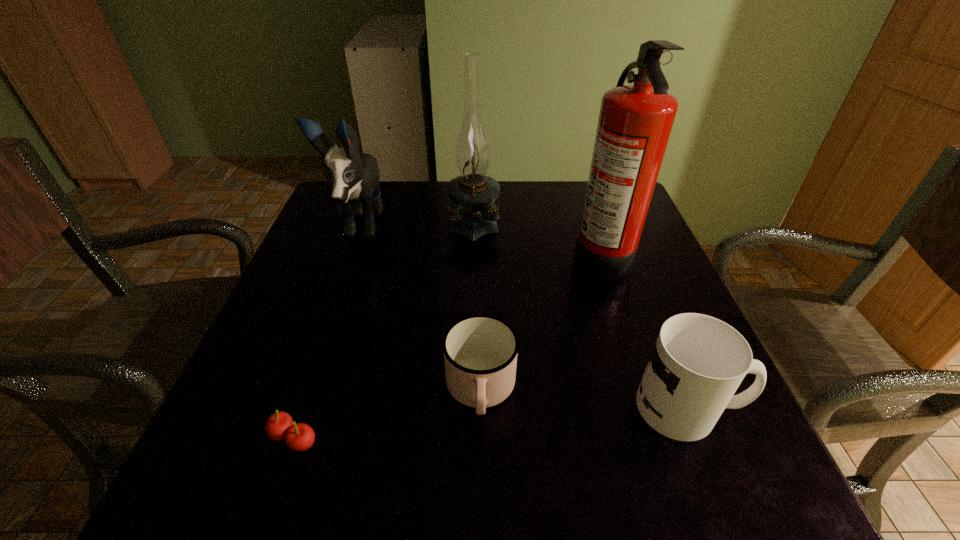
I want to click on cherry that is at the left edge, so click(299, 437).

Identify the location of fire extinguisher located in the right edge section of the desktop. (635, 121).

At what (x,y) coordinates should I click in order to perform the action: click on mug at the right edge. Please return your answer as a coordinate pair (x, y). This screenshot has width=960, height=540. Looking at the image, I should click on (698, 362).

You are a GUI agent. You are given a task and a screenshot of the screen. Output one action in this format:
    pyautogui.click(x=<x>, y=<y>)
    Task: Click on the object situated at the far left corner
    The image size is (960, 540).
    Given the screenshot: What is the action you would take?
    pyautogui.click(x=353, y=176)

Identify the location of object at the near left corner. Image resolution: width=960 pixels, height=540 pixels. (299, 437).

The width and height of the screenshot is (960, 540). I want to click on object located in the far right corner section of the desktop, so click(x=635, y=121).

Locate an element on the screen. Image resolution: width=960 pixels, height=540 pixels. vacant area at the far edge is located at coordinates (517, 203).

The image size is (960, 540). I want to click on vacant space at the near edge of the desktop, so click(x=418, y=450).

Locate an element on the screen. free space at the left edge of the desktop is located at coordinates (303, 302).

Where is `blank area at the right edge`? blank area at the right edge is located at coordinates (x=618, y=319).